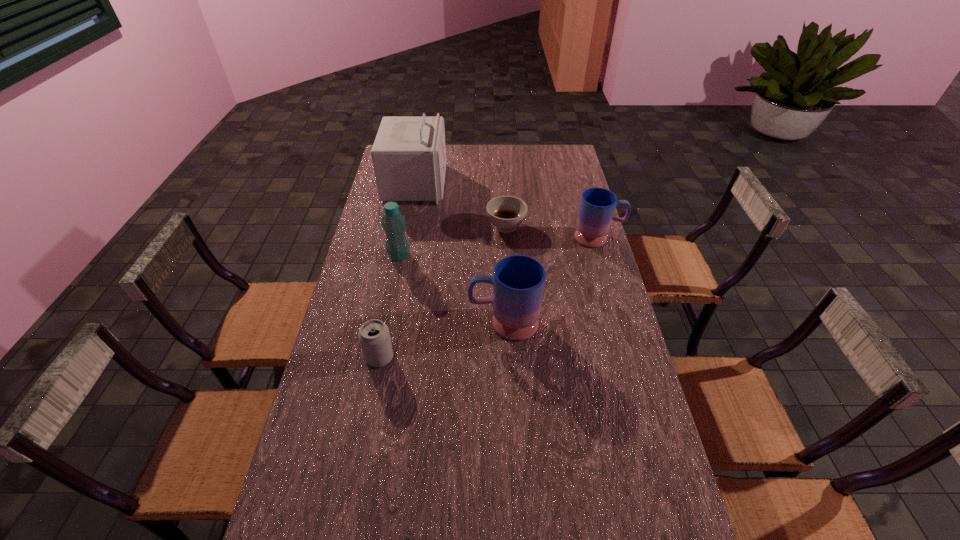
Locate an element on the screen. vacant region between the rightmost object and the water bottle is located at coordinates (499, 247).

Locate an element on the screen. Image resolution: width=960 pixels, height=540 pixels. free space between the rightmost object and the fifth farthest object is located at coordinates (551, 280).

Where is `empty location between the shorter mug and the water bottle`? The height and width of the screenshot is (540, 960). empty location between the shorter mug and the water bottle is located at coordinates (499, 247).

Where is `free spot between the water bottle and the second nearest object`? free spot between the water bottle and the second nearest object is located at coordinates (451, 289).

This screenshot has height=540, width=960. In order to click on empty location between the nearest object and the tallest object in this screenshot , I will do `click(397, 271)`.

Locate an element on the screen. blank region between the left mug and the water bottle is located at coordinates (451, 289).

Locate an element on the screen. object that is the closest to the water bottle is located at coordinates (409, 152).

The image size is (960, 540). In order to click on object that is the closest to the water bottle in this screenshot , I will do `click(409, 152)`.

The width and height of the screenshot is (960, 540). Identify the location of vacant space that satisfies the following two spatial constraints: 1. on the front-facing side of the soup bowl; 2. on the left side of the first-aid kit. (407, 227).

Where is `vacant position in the image that satisfies the following two spatial constraints: 1. on the front-facing side of the tallest object; 2. on the back side of the soup bowl`? vacant position in the image that satisfies the following two spatial constraints: 1. on the front-facing side of the tallest object; 2. on the back side of the soup bowl is located at coordinates (407, 227).